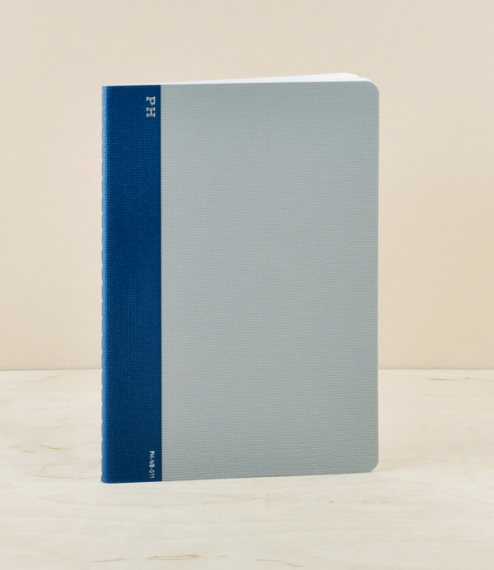
You are a GUI agent. You are given a task and a screenshot of the screen. Output one action in this format:
    pyautogui.click(x=<x>, y=<y>)
    Task: Click on the cream background with some faint brown stripes
    The height and width of the screenshot is (570, 494).
    Given the screenshot: What is the action you would take?
    pyautogui.click(x=408, y=502), pyautogui.click(x=62, y=500), pyautogui.click(x=187, y=555), pyautogui.click(x=55, y=443), pyautogui.click(x=29, y=445), pyautogui.click(x=439, y=378)